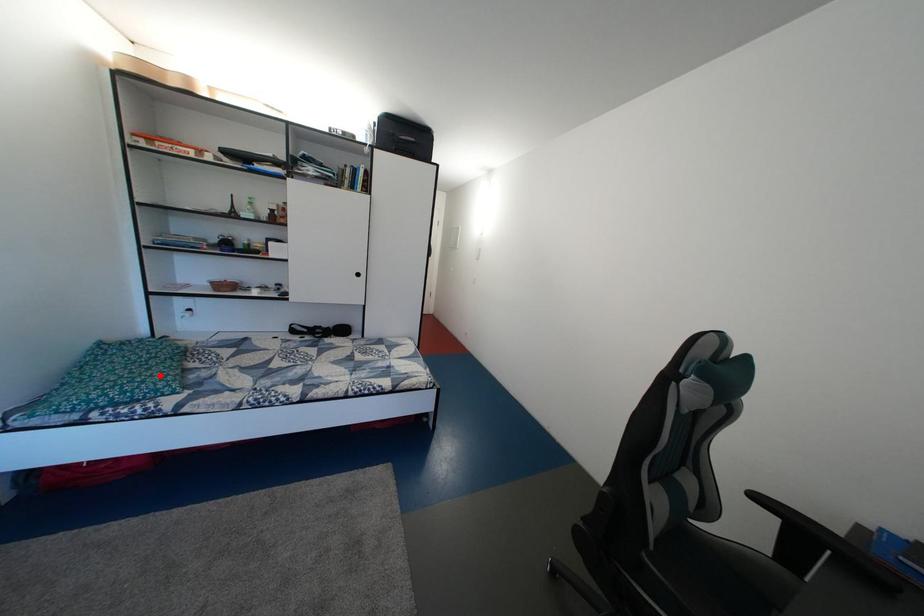
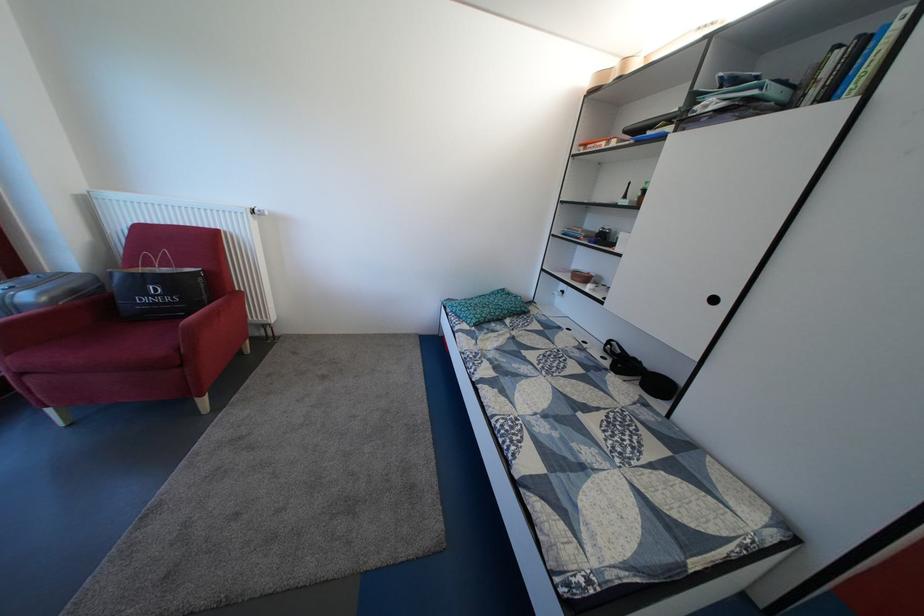
Question: I am providing you with two images of the same scene from different viewpoints. A red point is marked on the first image. Can you still see the location of the red point in image 2?

Choices:
 (A) Yes
 (B) No

Answer: (A)